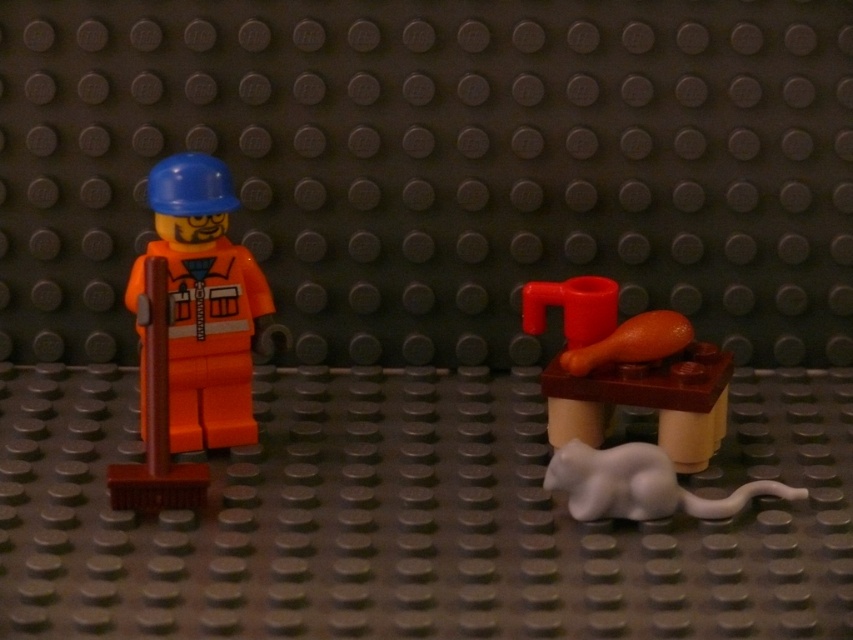
Based on the photo, can you confirm if smooth brown table at right is thinner than white matte mouse at lower right?

No.

Between smooth brown table at right and white matte mouse at lower right, which one has less height?

white matte mouse at lower right is shorter.

Between point (610, 394) and point (622, 477), which one is positioned in front?

Point (622, 477) is in front.

Identify the location of smooth brown table at right. (x=631, y=404).

Between smooth brown table at right and orange matte construction worker at left, which one is positioned lower?

smooth brown table at right

This screenshot has width=853, height=640. Identify the location of smooth brown table at right. (631, 404).

Describe the element at coordinates (631, 404) in the screenshot. I see `smooth brown table at right` at that location.

Find the location of a particular element. smooth brown table at right is located at coordinates (631, 404).

Who is positioned more to the left, orange matte construction worker at left or white matte mouse at lower right?

Positioned to the left is orange matte construction worker at left.

Is point (228, 438) positioned after point (635, 506)?

Yes, point (228, 438) is behind point (635, 506).

Does point (189, 236) come closer to viewer compared to point (573, 515)?

No, it is not.

Identify the location of orange matte construction worker at left. The height and width of the screenshot is (640, 853). (202, 301).